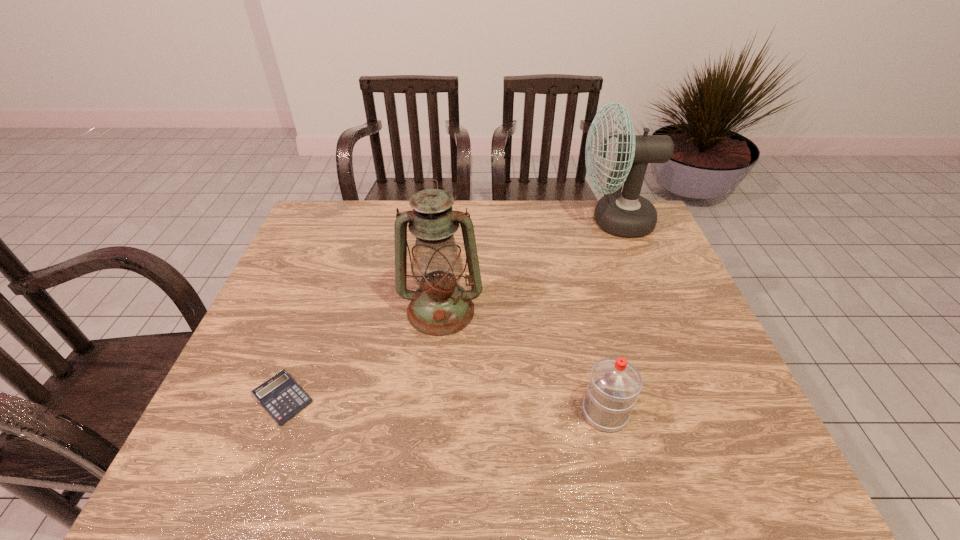
This screenshot has height=540, width=960. Identify the location of vacant space that's between the rightmost object and the third tallest object. (610, 316).

At what (x,y) coordinates should I click in order to perform the action: click on vacant space in between the rightmost object and the second farthest object. Please return your answer as a coordinate pair (x, y). Looking at the image, I should click on (528, 266).

This screenshot has width=960, height=540. Identify the location of free space that is in between the fan and the second object from right to left. (610, 316).

The height and width of the screenshot is (540, 960). Identify the location of unoccupied area between the water bottle and the calculator. (444, 406).

You are a GUI agent. You are given a task and a screenshot of the screen. Output one action in this format:
    pyautogui.click(x=<x>, y=<y>)
    Task: Click on the free space between the third object from left to right and the shortest object
    This screenshot has width=960, height=540.
    Given the screenshot: What is the action you would take?
    pyautogui.click(x=444, y=406)

Point out which object is positioned as the nearest to the second object from right to left. Please provide its 2D coordinates. Your answer should be formatted as a tuple, i.e. [(x, y)], where the tuple contains the x and y coordinates of a point satisfying the conditions above.

[(440, 306)]

Select which object appears as the closest to the fan. Please provide its 2D coordinates. Your answer should be formatted as a tuple, i.e. [(x, y)], where the tuple contains the x and y coordinates of a point satisfying the conditions above.

[(440, 306)]

In order to click on free space that satisfies the following two spatial constraints: 1. in front of the rightmost object where the airflow is directed; 2. on the front side of the second farthest object in this screenshot , I will do `click(650, 310)`.

Find the location of a particular element. Image resolution: width=960 pixels, height=540 pixels. vacant region that satisfies the following two spatial constraints: 1. on the back side of the leftmost object; 2. on the left side of the oil lamp is located at coordinates (317, 310).